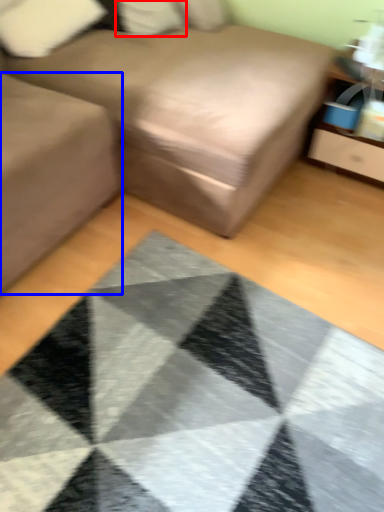
Question: Among these objects, which one is farthest to the camera, pillow (highlighted by a red box) or gray (highlighted by a blue box)?

Choices:
 (A) pillow
 (B) gray

Answer: (A)